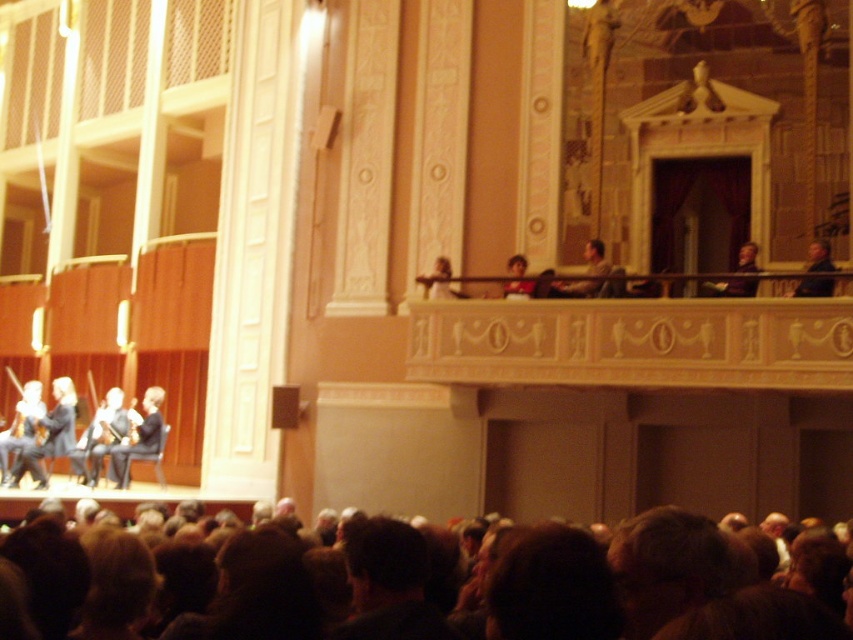
Consider the image. Does dark brown hair at lower center have a greater height compared to light gray suit at stage left?

Yes, dark brown hair at lower center is taller than light gray suit at stage left.

Based on the photo, can you confirm if dark brown hair at lower center is bigger than light gray suit at stage left?

Yes.

Is point (820, 637) closer to viewer compared to point (22, 474)?

That is True.

The image size is (853, 640). In order to click on dark brown hair at lower center in this screenshot , I will do point(553,588).

Who is taller, light gray suit at stage left or dark gray suit at stage left?

dark gray suit at stage left is taller.

Between point (68, 394) and point (160, 404), which one is positioned in front?

Point (160, 404) is more forward.

Find the location of `light gray suit at stage left`. light gray suit at stage left is located at coordinates (48, 435).

Who is more distant from viewer, [70,442] or [592,252]?

The point [70,442] is more distant.

Identify the location of light gray suit at stage left. This screenshot has height=640, width=853. (48, 435).